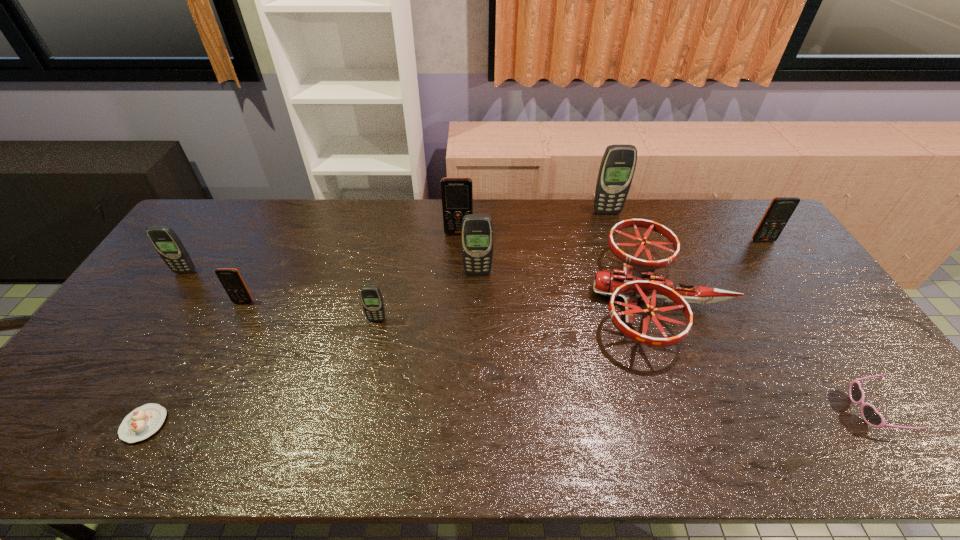
This screenshot has width=960, height=540. I want to click on the second nearest cellular telephone, so click(x=230, y=278).

This screenshot has width=960, height=540. In order to click on the smallest gray cellular telephone in this screenshot , I will do `click(371, 298)`.

What are the coordinates of `the fourth object from left to right` in the screenshot? It's located at (371, 298).

The image size is (960, 540). I want to click on red drone, so coord(637,280).

At what (x,y) coordinates should I click in order to perform the action: click on pink sunglasses. Please return your answer as a coordinate pair (x, y). The width and height of the screenshot is (960, 540). Looking at the image, I should click on (871, 416).

Find the location of a particular element. This screenshot has height=540, width=960. sunglasses is located at coordinates (871, 416).

Find the location of a particular element. the ninth object from right to left is located at coordinates (142, 422).

At what (x,y) coordinates should I click in order to perform the action: click on the shortest object. Please return your answer as a coordinate pair (x, y). Image resolution: width=960 pixels, height=540 pixels. Looking at the image, I should click on [142, 422].

This screenshot has height=540, width=960. What are the coordinates of `vacant space located on the screen of the rightmost gray cellular telephone` in the screenshot? It's located at (611, 225).

Image resolution: width=960 pixels, height=540 pixels. Identify the location of free space located on the screen of the biggest orange cellular telephone. (455, 310).